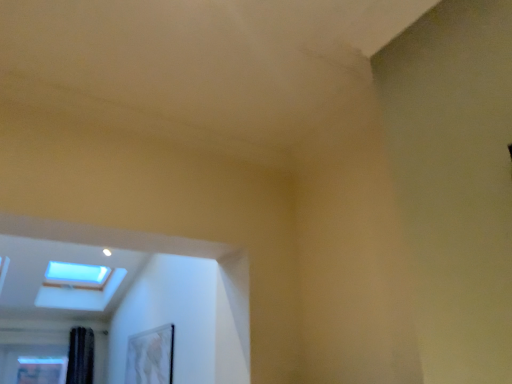
Measure the distance between point (144, 380) and camera.

The depth of point (144, 380) is 3.78 meters.

What do you see at coordinates (150, 356) in the screenshot? The width and height of the screenshot is (512, 384). I see `matte white picture frame at lower left` at bounding box center [150, 356].

What is the approximate height of matte white picture frame at lower left?

matte white picture frame at lower left is 18.62 inches in height.

Measure the distance between matte white picture frame at lower left and camera.

matte white picture frame at lower left is 3.28 meters away from camera.

I want to click on matte white picture frame at lower left, so click(150, 356).

Identify the location of matte white picture frame at lower left. The width and height of the screenshot is (512, 384). pos(150,356).